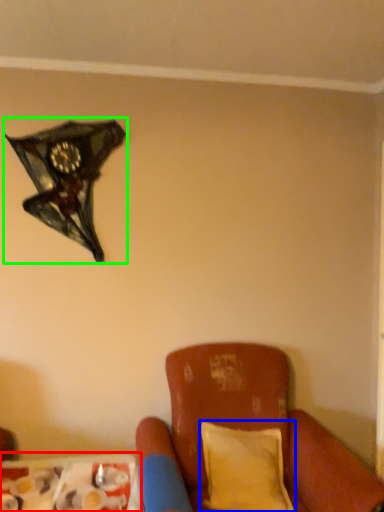
Question: Considering the real-world distances, which object is farthest from table (highlighted by a red box)? pillow (highlighted by a blue box) or lamp (highlighted by a green box)?

Choices:
 (A) pillow
 (B) lamp

Answer: (B)